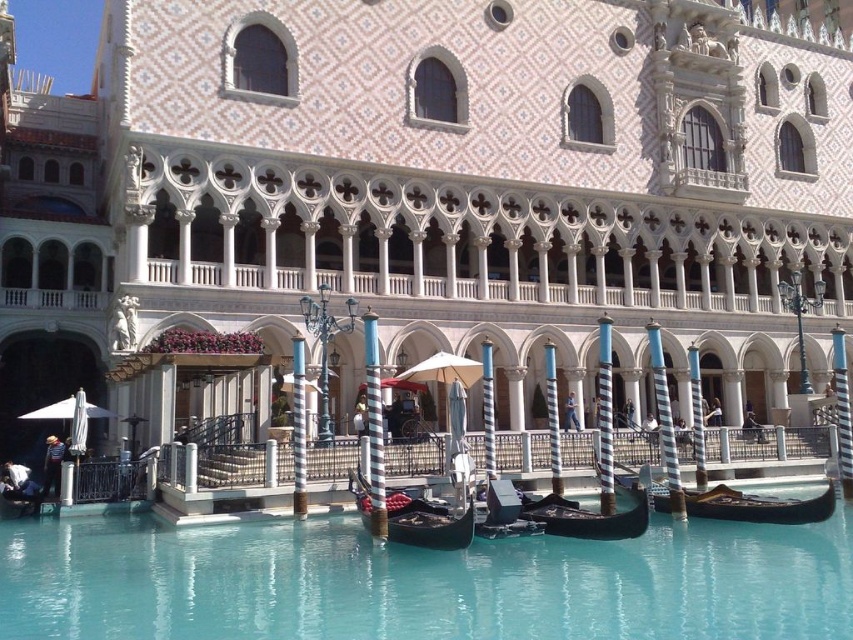
Question: Is wooden gondola at center positioned at the back of striped wood pillar at center?

Choices:
 (A) yes
 (B) no

Answer: (B)

Question: Which point appears closest to the camera in this image?

Choices:
 (A) (296, 476)
 (B) (544, 627)
 (C) (366, 355)
 (D) (471, 513)

Answer: (B)

Question: Which object is closer to the camera taking this photo?

Choices:
 (A) black polished wood gondola at center
 (B) clear glass water at center

Answer: (B)

Question: Which object is positioned closest to the metallic gold gondola at center?

Choices:
 (A) clear glass water at center
 (B) wooden gondola at center

Answer: (B)

Question: Is clear glass water at center below black polished wood gondola at center?

Choices:
 (A) no
 (B) yes

Answer: (B)

Question: Does white striped metal rail at center have a greater width compared to striped wood pillar at center?

Choices:
 (A) yes
 (B) no

Answer: (A)